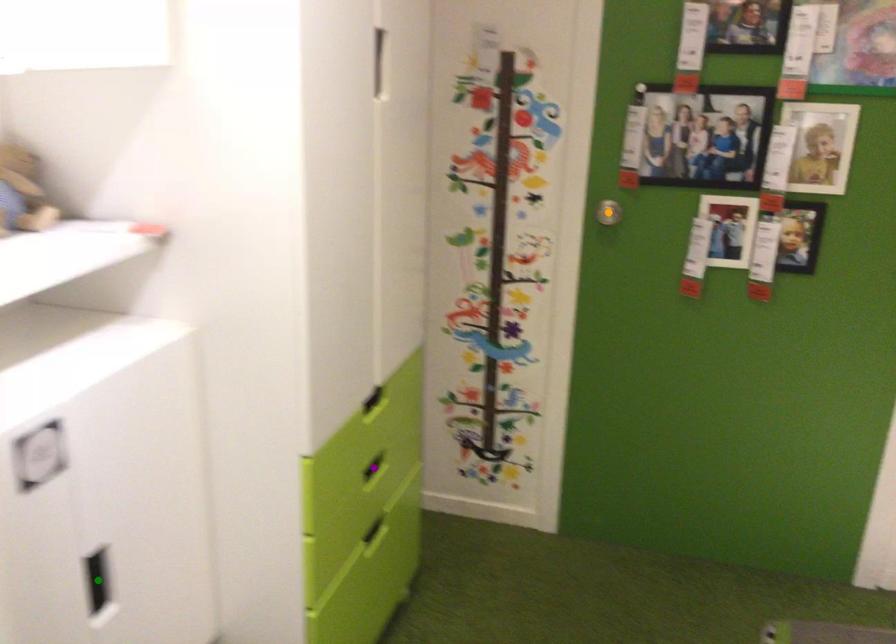
Order these from nearest to farthest:
A) orange point
B) green point
C) purple point

1. green point
2. purple point
3. orange point